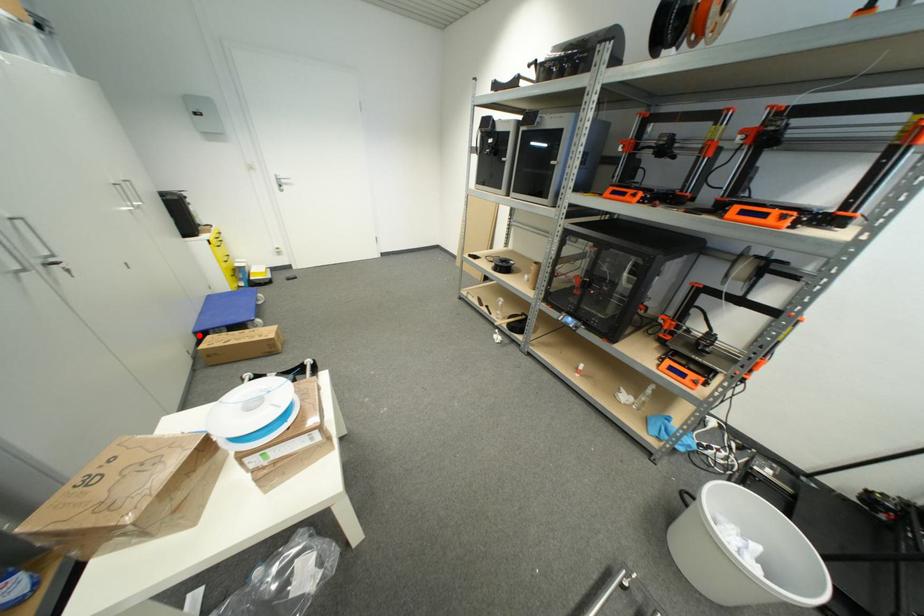
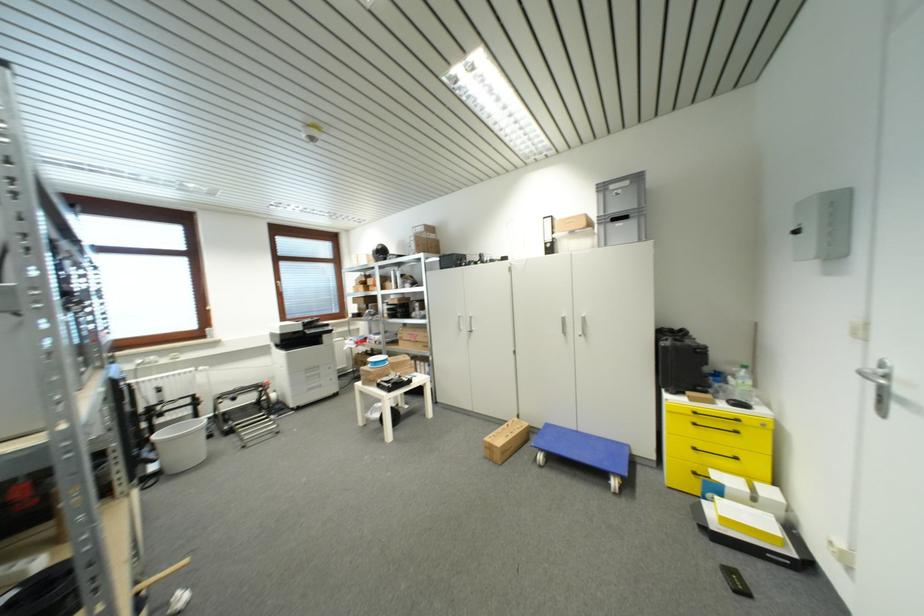
Question: I am providing you with two images of the same scene from different viewpoints. A red point is marked on the first image. Can you still see the location of the red point in image 2?

Choices:
 (A) Yes
 (B) No

Answer: (A)